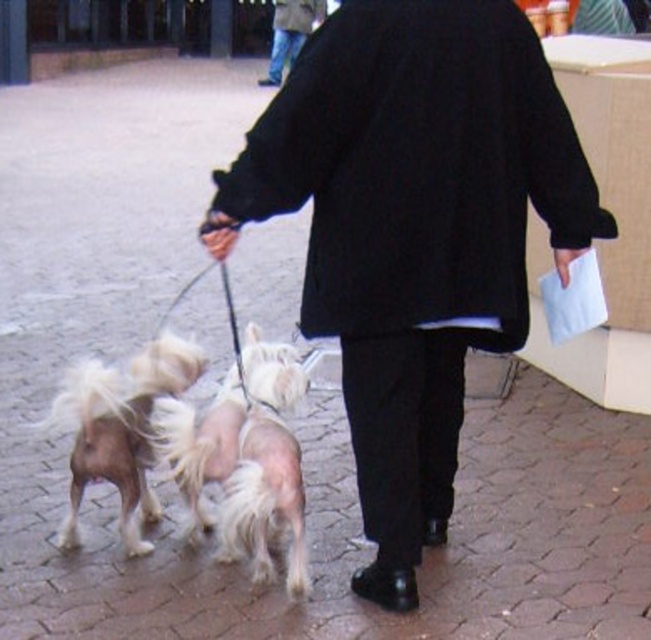
Is shiny golden fur at center bigger than black wool coat at upper center?

No, shiny golden fur at center is not bigger than black wool coat at upper center.

Is shiny golden fur at center positioned in front of black wool coat at upper center?

That is True.

The image size is (651, 640). I want to click on shiny golden fur at center, so click(x=201, y=445).

This screenshot has width=651, height=640. Find the location of `shiny golden fur at center`. shiny golden fur at center is located at coordinates (201, 445).

Does point (141, 445) lie in front of point (189, 493)?

That is True.

Is shiny brown fur at lower left positioned in front of shiny golden fur at center?

That is False.

Is point (87, 371) positioned before point (215, 452)?

Yes, it is.

Locate an element on the screen. This screenshot has width=651, height=640. shiny brown fur at lower left is located at coordinates (118, 428).

Is shiny brown fur at lower left shorter than shiny white fur at center?

No, shiny brown fur at lower left is not shorter than shiny white fur at center.

Is point (122, 444) closer to camera compared to point (255, 477)?

No, (122, 444) is behind (255, 477).

Locate an element on the screen. The height and width of the screenshot is (640, 651). shiny brown fur at lower left is located at coordinates (118, 428).